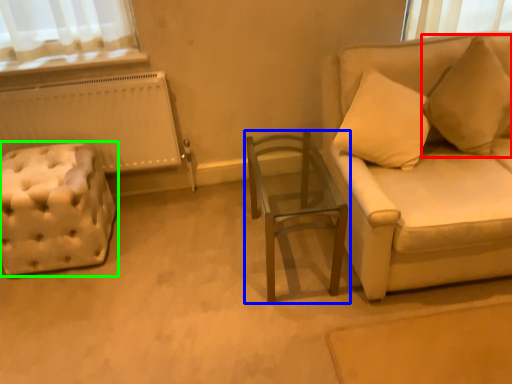
Question: Estimate the real-world distances between objects in this image. Which object is farther from pillow (highlighted by a red box), table (highlighted by a blue box) or furniture (highlighted by a green box)?

Choices:
 (A) table
 (B) furniture

Answer: (B)